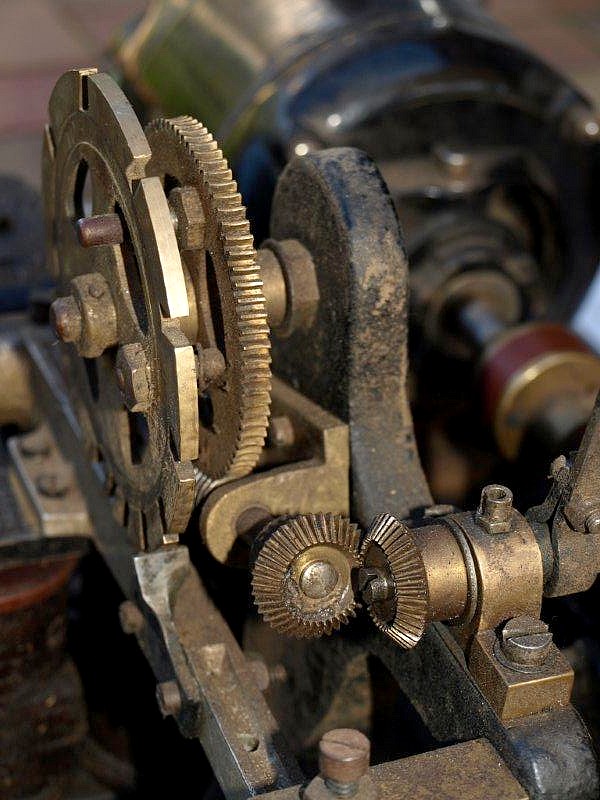
At what (x,y) coordinates should I click in order to perform the action: click on screws. Please return your answer as a coordinate pair (x, y). The height and width of the screenshot is (800, 600). Looking at the image, I should click on coord(343,745), coord(542,632), coord(325,581), coord(363,584), coord(167,698), coord(131,620), coord(122,378), coord(56,478), coord(33,445), coord(562,462).